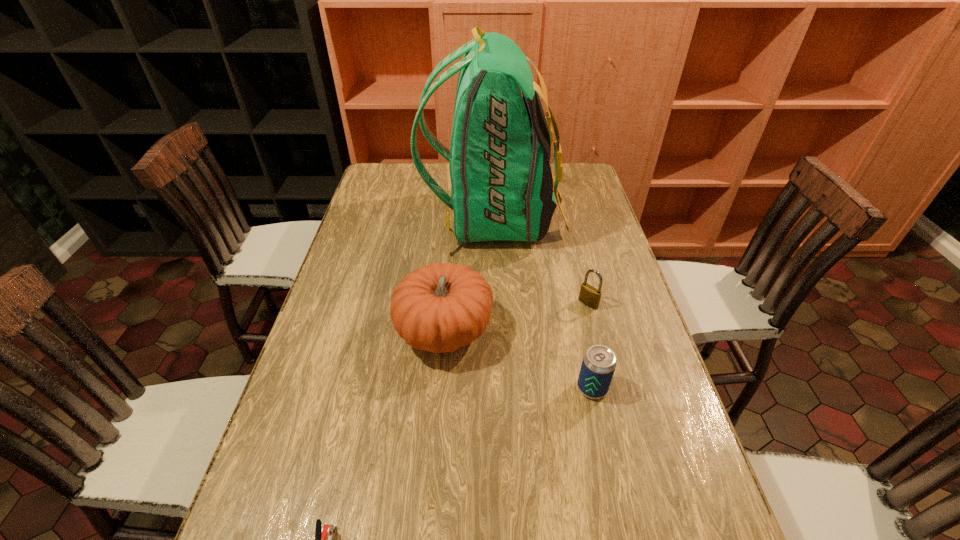
What are the coordinates of `free spot located on the right of the beer can` in the screenshot? It's located at (651, 388).

The image size is (960, 540). Find the location of `object located at the far edge`. object located at the far edge is located at coordinates (501, 181).

The image size is (960, 540). Find the location of `backpack that is at the right edge`. backpack that is at the right edge is located at coordinates pos(501,181).

The width and height of the screenshot is (960, 540). I want to click on padlock that is at the right edge, so click(590, 296).

The width and height of the screenshot is (960, 540). Identify the location of beer can that is positioned at the right edge. (599, 362).

Identify the location of object present at the far right corner. This screenshot has width=960, height=540. (501, 181).

Find the location of a particular element. The image size is (960, 540). vacant space at the left edge is located at coordinates (328, 325).

At what (x,y) coordinates should I click in order to perform the action: click on free location at the right edge of the desktop. Please return your answer as a coordinate pair (x, y). The width and height of the screenshot is (960, 540). Looking at the image, I should click on (617, 299).

In the image, there is a desktop. Where is `free space at the far left corner`? The width and height of the screenshot is (960, 540). free space at the far left corner is located at coordinates (387, 163).

Locate an element on the screen. This screenshot has height=540, width=960. free space at the far right corner is located at coordinates (564, 190).